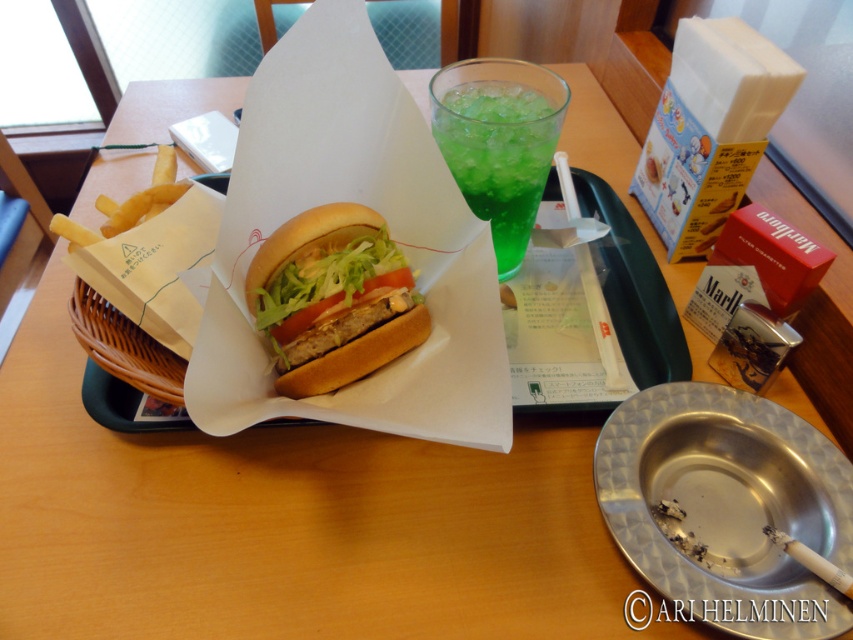
You are a food delivery person who needs to ensure the burger stays intact during transport. The golden brown bun at center and the white paper burger at center are part of the meal. Which object should you handle more carefully to prevent the burger from falling apart?

The golden brown bun at center has a smaller size compared to the white paper burger at center, so you should handle the golden brown bun at center more carefully to prevent the burger from falling apart.

Looking at this image, you are a waiter in a restaurant and need to place a 10 inch long decorative ribbon between the metallic ashtray at lower right and the green translucent glass at upper center. Can you fit the ribbon horizontally between them without overlapping either object?

The distance between the metallic ashtray at lower right and the green translucent glass at upper center is 9.19 inches. Since the ribbon is 10 inches long, it cannot fit horizontally between them without overlapping one of the objects.

You are a customer at the dining table and want to reach for the green translucent glass at upper center. Can you tell me the exact coordinates where the glass is located?

The green translucent glass at upper center is located at point (498, 154).